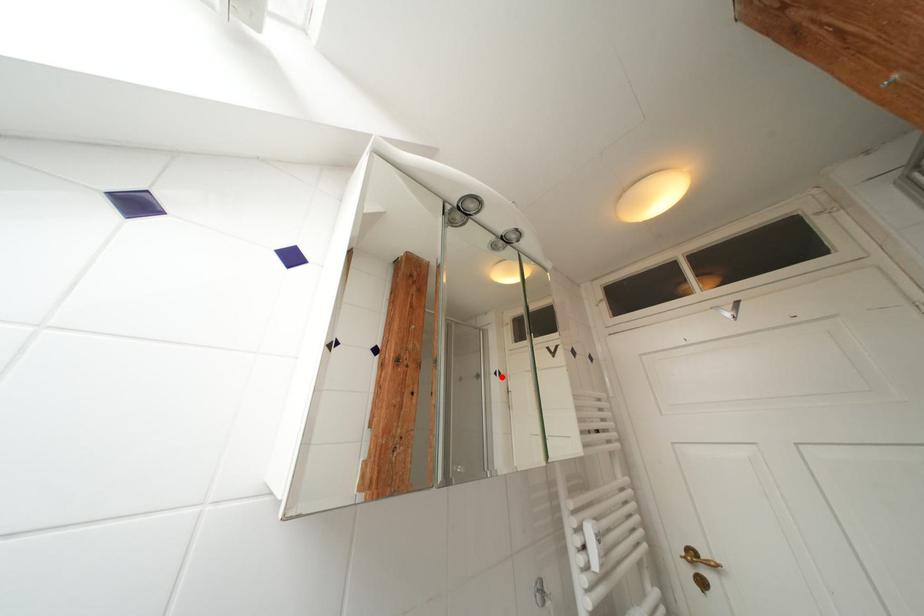
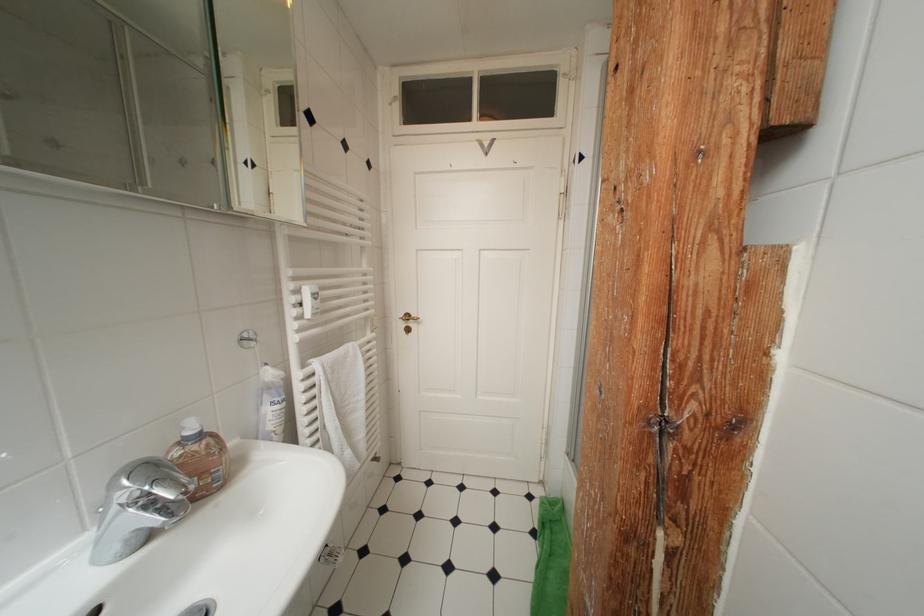
Where in the second image is the point corresponding to the highlighted location from the first image?

(253, 167)